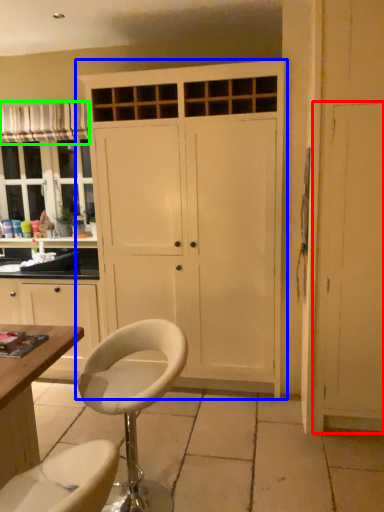
Question: Estimate the real-world distances between objects in this image. Which object is farther from screen door (highlighted by a red box), cupboard (highlighted by a blue box) or curtain (highlighted by a green box)?

Choices:
 (A) cupboard
 (B) curtain

Answer: (B)